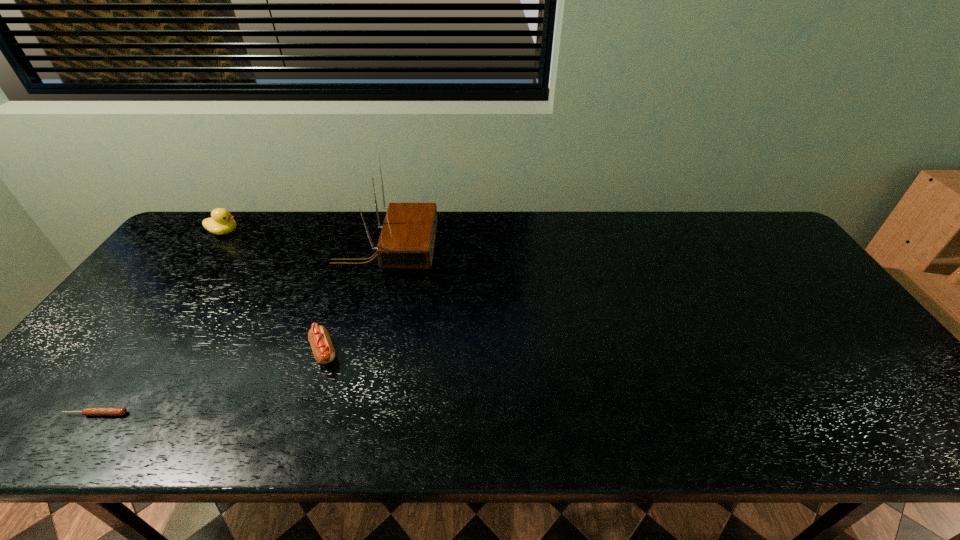
Find the location of a particular element. This screenshot has height=540, width=960. free location at the right edge of the desktop is located at coordinates (856, 335).

You are a GUI agent. You are given a task and a screenshot of the screen. Output one action in this format:
    pyautogui.click(x=<x>, y=<y>)
    Task: Click on the free space that is in between the left sausage and the tallest object
    The height and width of the screenshot is (540, 960).
    Given the screenshot: What is the action you would take?
    pyautogui.click(x=241, y=331)

Find the location of `free space between the radio_receiver and the nearer sausage`. free space between the radio_receiver and the nearer sausage is located at coordinates (241, 331).

Locate an element on the screen. The width and height of the screenshot is (960, 540). free point between the taller sausage and the duckling is located at coordinates (274, 292).

This screenshot has height=540, width=960. Find the location of `unoccupied position between the tallest object and the shorter sausage`. unoccupied position between the tallest object and the shorter sausage is located at coordinates (241, 331).

The image size is (960, 540). I want to click on free area in between the radio_receiver and the duckling, so click(x=304, y=240).

Find the location of a particular element. The image size is (960, 540). free spot between the nearest object and the second tallest object is located at coordinates (160, 323).

I want to click on empty space between the second tallest object and the tallest object, so click(x=304, y=240).

Where is `empty space that is in between the nearest object and the right sausage`? This screenshot has width=960, height=540. empty space that is in between the nearest object and the right sausage is located at coordinates (210, 383).

Locate an element on the screen. This screenshot has height=540, width=960. unoccupied area between the tallest object and the second shortest object is located at coordinates (354, 300).